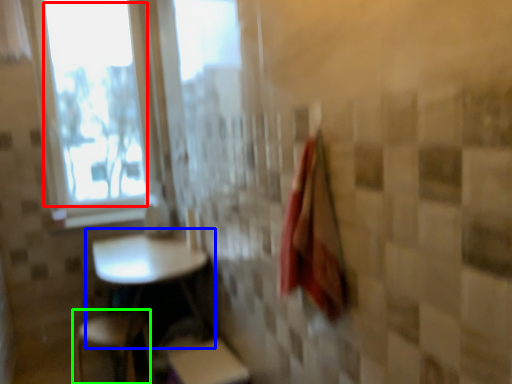
Question: Which object is the closest to the window screen (highlighted by a red box)? Choose among these: table (highlighted by a blue box) or step stool (highlighted by a green box).

Choices:
 (A) table
 (B) step stool

Answer: (A)